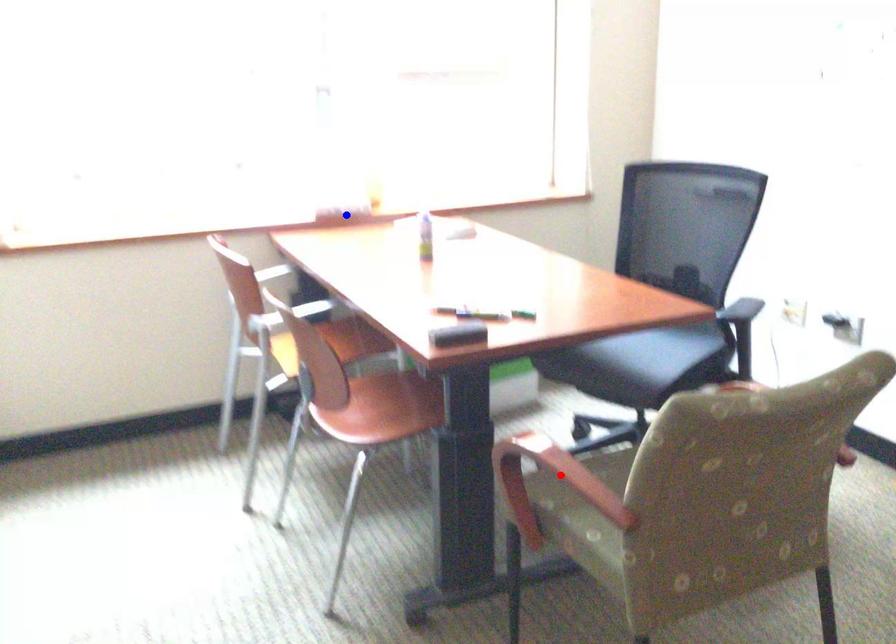
Question: In the image, two points are highlighted. Which point is nearer to the camera? Reply with the corresponding letter.

Choices:
 (A) blue point
 (B) red point

Answer: (B)